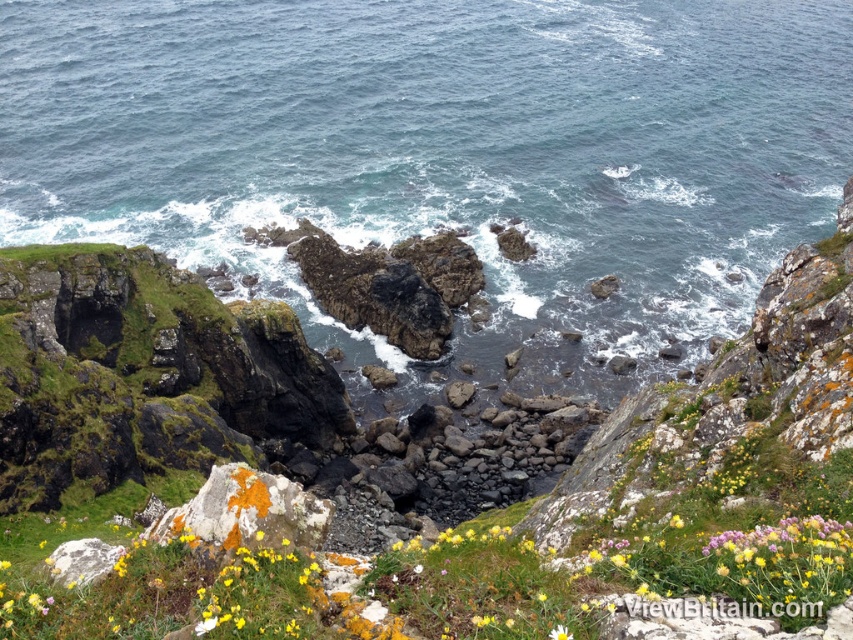
You are a hiker standing on the cliff looking down at the speckled gray rock at lower left and the white matte flower at center. Which object is closer to you?

The speckled gray rock at lower left is closer to you because it is in front of the white matte flower at center.

Based on the photo, you are standing at the cliff edge overlooking the scene. You see the blue water at center and the white matte flower at center. Which one is positioned to the left when facing the ocean?

The blue water at center is positioned to the left of the white matte flower at center.